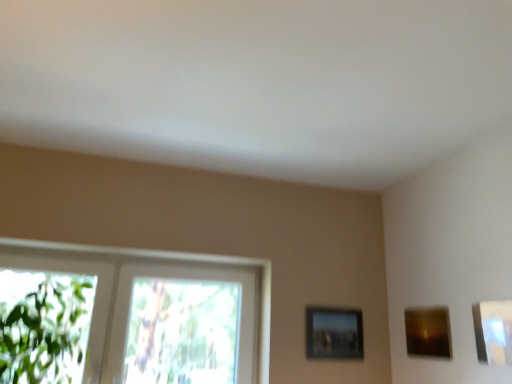
What do you see at coordinates (334, 333) in the screenshot? I see `metallic silver picture frame at center-right, the third picture frame in the front-to-back sequence` at bounding box center [334, 333].

What do you see at coordinates (493, 331) in the screenshot? I see `metallic silver picture frame at upper right, acting as the 3th picture frame starting from the back` at bounding box center [493, 331].

Locate an element on the screen. The image size is (512, 384). matte brown picture frame at upper right, acting as the second picture frame starting from the left is located at coordinates (428, 332).

Looking at this image, from the image's perspective, is clear glass window at left over metallic silver picture frame at upper right, acting as the 3th picture frame starting from the back?

Actually, clear glass window at left appears below metallic silver picture frame at upper right, acting as the 3th picture frame starting from the back, in the image.

Is clear glass window at left to the right of metallic silver picture frame at upper right, which is counted as the 1th picture frame, starting from the right, from the viewer's perspective?

Incorrect, clear glass window at left is not on the right side of metallic silver picture frame at upper right, which is counted as the 1th picture frame, starting from the right.

Is clear glass window at left situated inside metallic silver picture frame at upper right, arranged as the 3th picture frame when viewed from the left, or outside?

clear glass window at left is located beyond the bounds of metallic silver picture frame at upper right, arranged as the 3th picture frame when viewed from the left.

Between clear glass window at left and metallic silver picture frame at upper right, arranged as the 3th picture frame when viewed from the left, which one has larger width?

clear glass window at left is wider.

Considering the relative positions of metallic silver picture frame at upper right, arranged as the 3th picture frame when viewed from the left, and matte brown picture frame at upper right, acting as the second picture frame starting from the left, in the image provided, is metallic silver picture frame at upper right, arranged as the 3th picture frame when viewed from the left, to the left of matte brown picture frame at upper right, acting as the second picture frame starting from the left, from the viewer's perspective?

Incorrect, metallic silver picture frame at upper right, arranged as the 3th picture frame when viewed from the left, is not on the left side of matte brown picture frame at upper right, acting as the second picture frame starting from the left.

Based on the photo, is metallic silver picture frame at upper right, marked as the first picture frame in a front-to-back arrangement, smaller than matte brown picture frame at upper right, which ranks as the second picture frame in back-to-front order?

Yes.

Based on the photo, is matte brown picture frame at upper right, acting as the second picture frame starting from the left, surrounded by metallic silver picture frame at upper right, which is counted as the 1th picture frame, starting from the right?

No, metallic silver picture frame at upper right, which is counted as the 1th picture frame, starting from the right, does not contain matte brown picture frame at upper right, acting as the second picture frame starting from the left.

Can you tell me how much metallic silver picture frame at upper right, arranged as the 3th picture frame when viewed from the left, and matte brown picture frame at upper right, positioned as the second picture frame in front-to-back order, differ in facing direction?

The angle between the facing direction of metallic silver picture frame at upper right, arranged as the 3th picture frame when viewed from the left, and the facing direction of matte brown picture frame at upper right, positioned as the second picture frame in front-to-back order, is 1.71 degrees.

Locate an element on the screen. Image resolution: width=512 pixels, height=384 pixels. picture frame below the matte brown picture frame at upper right, positioned as the second picture frame in front-to-back order (from the image's perspective) is located at coordinates (334, 333).

Looking at this image, are metallic silver picture frame at center-right, positioned as the 1th picture frame in left-to-right order, and matte brown picture frame at upper right, which appears as the 2th picture frame when viewed from the right, located far from each other?

Actually, metallic silver picture frame at center-right, positioned as the 1th picture frame in left-to-right order, and matte brown picture frame at upper right, which appears as the 2th picture frame when viewed from the right, are a little close together.

Is metallic silver picture frame at center-right, acting as the 3th picture frame starting from the right, to the right of matte brown picture frame at upper right, positioned as the second picture frame in front-to-back order, from the viewer's perspective?

Incorrect, metallic silver picture frame at center-right, acting as the 3th picture frame starting from the right, is not on the right side of matte brown picture frame at upper right, positioned as the second picture frame in front-to-back order.

In the scene shown: Is metallic silver picture frame at center-right, the 1th picture frame when ordered from back to front, not within matte brown picture frame at upper right, acting as the second picture frame starting from the left?

Indeed, metallic silver picture frame at center-right, the 1th picture frame when ordered from back to front, is completely outside matte brown picture frame at upper right, acting as the second picture frame starting from the left.

Considering the positions of objects clear glass window at left and matte brown picture frame at upper right, which appears as the 2th picture frame when viewed from the right, in the image provided, who is in front, clear glass window at left or matte brown picture frame at upper right, which appears as the 2th picture frame when viewed from the right,?

matte brown picture frame at upper right, which appears as the 2th picture frame when viewed from the right, is more forward.

Is clear glass window at left wider or thinner than matte brown picture frame at upper right, which ranks as the second picture frame in back-to-front order?

Clearly, clear glass window at left has more width compared to matte brown picture frame at upper right, which ranks as the second picture frame in back-to-front order.

Is matte brown picture frame at upper right, positioned as the second picture frame in front-to-back order, at the back of clear glass window at left?

clear glass window at left does not have its back to matte brown picture frame at upper right, positioned as the second picture frame in front-to-back order.

Is metallic silver picture frame at center-right, the third picture frame in the front-to-back sequence, next to clear glass window at left and touching it?

metallic silver picture frame at center-right, the third picture frame in the front-to-back sequence, is not next to clear glass window at left, and they're not touching.

Is metallic silver picture frame at center-right, the 1th picture frame when ordered from back to front, thinner than clear glass window at left?

Indeed, metallic silver picture frame at center-right, the 1th picture frame when ordered from back to front, has a lesser width compared to clear glass window at left.

From the image's perspective, is metallic silver picture frame at center-right, acting as the 3th picture frame starting from the right, above or below clear glass window at left?

Clearly, from the image's perspective, metallic silver picture frame at center-right, acting as the 3th picture frame starting from the right, is below clear glass window at left.

There is a matte brown picture frame at upper right, positioned as the second picture frame in front-to-back order. At what (x,y) coordinates should I click in order to perform the action: click on picture frame above it (from a real-world perspective). Please return your answer as a coordinate pair (x, y). This screenshot has width=512, height=384. Looking at the image, I should click on (493, 331).

Is matte brown picture frame at upper right, which ranks as the second picture frame in back-to-front order, positioned far away from metallic silver picture frame at upper right, marked as the first picture frame in a front-to-back arrangement?

No, matte brown picture frame at upper right, which ranks as the second picture frame in back-to-front order, is not far from metallic silver picture frame at upper right, marked as the first picture frame in a front-to-back arrangement.

Is point (446, 354) positioned before point (508, 304)?

No.

Considering the sizes of objects matte brown picture frame at upper right, which ranks as the second picture frame in back-to-front order, and metallic silver picture frame at upper right, acting as the 3th picture frame starting from the back, in the image provided, who is wider, matte brown picture frame at upper right, which ranks as the second picture frame in back-to-front order, or metallic silver picture frame at upper right, acting as the 3th picture frame starting from the back,?

Wider between the two is matte brown picture frame at upper right, which ranks as the second picture frame in back-to-front order.

Who is taller, metallic silver picture frame at center-right, positioned as the 1th picture frame in left-to-right order, or metallic silver picture frame at upper right, acting as the 3th picture frame starting from the back?

metallic silver picture frame at center-right, positioned as the 1th picture frame in left-to-right order, is taller.

Is metallic silver picture frame at center-right, the 1th picture frame when ordered from back to front, facing away from metallic silver picture frame at upper right, marked as the first picture frame in a front-to-back arrangement?

No.

Is metallic silver picture frame at center-right, the 1th picture frame when ordered from back to front, directly adjacent to metallic silver picture frame at upper right, acting as the 3th picture frame starting from the back?

They are not placed beside each other.

Looking at their sizes, would you say metallic silver picture frame at center-right, acting as the 3th picture frame starting from the right, is wider or thinner than metallic silver picture frame at upper right, acting as the 3th picture frame starting from the back?

Considering their sizes, metallic silver picture frame at center-right, acting as the 3th picture frame starting from the right, looks broader than metallic silver picture frame at upper right, acting as the 3th picture frame starting from the back.

From a real-world perspective, count 1st picture frames downward from the clear glass window at left and point to it. Please provide its 2D coordinates.

[(493, 331)]

Identify the location of picture frame that appears on the right of matte brown picture frame at upper right, which ranks as the second picture frame in back-to-front order. Image resolution: width=512 pixels, height=384 pixels. pos(493,331).

From the image, which object appears to be farther from metallic silver picture frame at upper right, acting as the 3th picture frame starting from the back, metallic silver picture frame at center-right, the third picture frame in the front-to-back sequence, or clear glass window at left?

clear glass window at left is further to metallic silver picture frame at upper right, acting as the 3th picture frame starting from the back.

Considering their positions, is matte brown picture frame at upper right, which ranks as the second picture frame in back-to-front order, positioned further to metallic silver picture frame at upper right, arranged as the 3th picture frame when viewed from the left, than clear glass window at left?

clear glass window at left.

Looking at this image, from the image, which object appears to be nearer to clear glass window at left, metallic silver picture frame at upper right, which is counted as the 1th picture frame, starting from the right, or matte brown picture frame at upper right, acting as the second picture frame starting from the left?

matte brown picture frame at upper right, acting as the second picture frame starting from the left, lies closer to clear glass window at left than the other object.

Which object lies further to the anchor point matte brown picture frame at upper right, acting as the second picture frame starting from the left, metallic silver picture frame at center-right, the third picture frame in the front-to-back sequence, or clear glass window at left?

clear glass window at left is further to matte brown picture frame at upper right, acting as the second picture frame starting from the left.

Based on their spatial positions, is metallic silver picture frame at center-right, the third picture frame in the front-to-back sequence, or matte brown picture frame at upper right, which appears as the 2th picture frame when viewed from the right, further from metallic silver picture frame at upper right, acting as the 3th picture frame starting from the back?

The object further to metallic silver picture frame at upper right, acting as the 3th picture frame starting from the back, is metallic silver picture frame at center-right, the third picture frame in the front-to-back sequence.

Estimate the real-world distances between objects in this image. Which object is closer to metallic silver picture frame at center-right, the third picture frame in the front-to-back sequence, matte brown picture frame at upper right, which appears as the 2th picture frame when viewed from the right, or clear glass window at left?

matte brown picture frame at upper right, which appears as the 2th picture frame when viewed from the right, is closer to metallic silver picture frame at center-right, the third picture frame in the front-to-back sequence.

Looking at the image, which one is located closer to clear glass window at left, metallic silver picture frame at upper right, marked as the first picture frame in a front-to-back arrangement, or metallic silver picture frame at center-right, the 1th picture frame when ordered from back to front?

metallic silver picture frame at center-right, the 1th picture frame when ordered from back to front.

From the image, which object appears to be farther from metallic silver picture frame at center-right, the 1th picture frame when ordered from back to front, clear glass window at left or matte brown picture frame at upper right, acting as the second picture frame starting from the left?

clear glass window at left.

Locate an element on the screen. picture frame positioned between metallic silver picture frame at upper right, acting as the 3th picture frame starting from the back, and metallic silver picture frame at center-right, positioned as the 1th picture frame in left-to-right order, from near to far is located at coordinates (428, 332).

Image resolution: width=512 pixels, height=384 pixels. I want to click on picture frame between clear glass window at left and matte brown picture frame at upper right, which ranks as the second picture frame in back-to-front order, from left to right, so click(x=334, y=333).